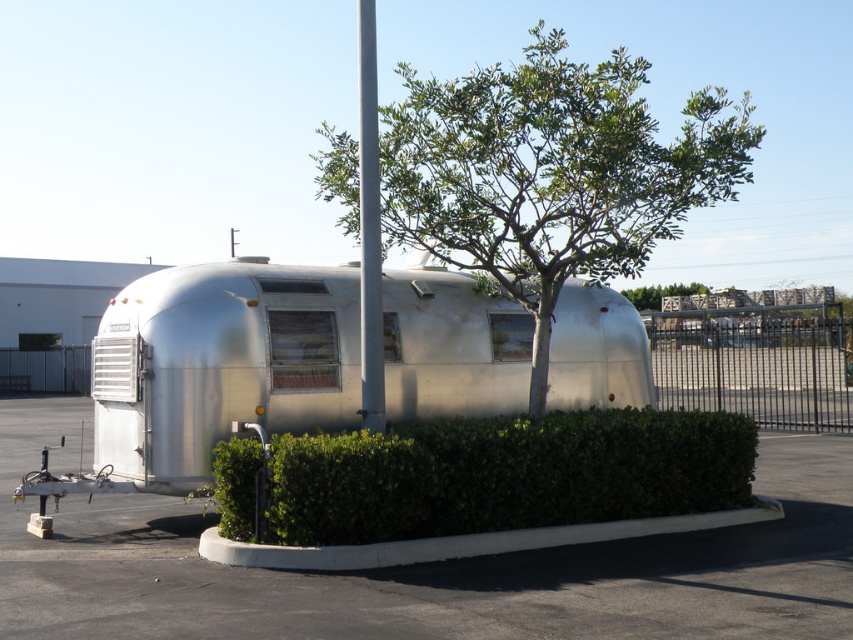
Question: Among these points, which one is nearest to the camera?

Choices:
 (A) (369, 310)
 (B) (326, 458)

Answer: (B)

Question: Which of the following is the farthest from the observer?

Choices:
 (A) (598, 481)
 (B) (369, 26)

Answer: (A)

Question: Can you confirm if white glossy pole at center is positioned to the left of green leafy tree at upper center?

Choices:
 (A) yes
 (B) no

Answer: (A)

Question: Can you confirm if green leafy hedge at center is positioned to the right of white glossy pole at center?

Choices:
 (A) no
 (B) yes

Answer: (B)

Question: Which object appears closest to the camera in this image?

Choices:
 (A) green leafy tree at upper center
 (B) silver metallic trailer at center

Answer: (B)

Question: Is green leafy tree at center behind white glossy pole at center?

Choices:
 (A) yes
 (B) no

Answer: (A)